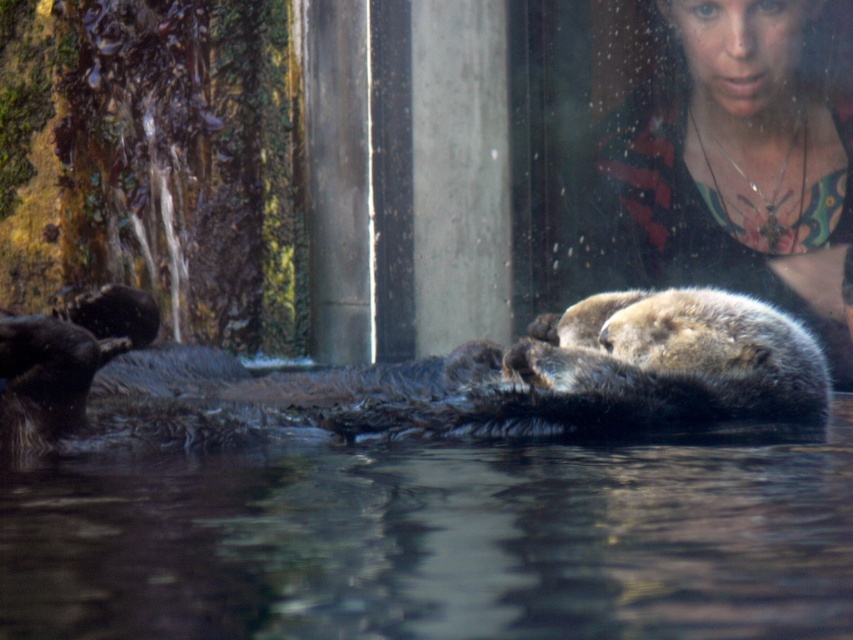
Consider the image. Does transparent water at center have a lesser width compared to smooth black shirt at upper right?

No, transparent water at center is not thinner than smooth black shirt at upper right.

In the scene shown: Who is shorter, transparent water at center or smooth black shirt at upper right?

transparent water at center

Which is in front, point (363, 538) or point (840, 248)?

Point (363, 538)

Find the location of a particular element. The image size is (853, 640). transparent water at center is located at coordinates (439, 541).

Who is positioned more to the left, dark brown fur otter at center or smooth black shirt at upper right?

Positioned to the left is dark brown fur otter at center.

Does point (471, 364) come in front of point (683, 124)?

Yes, point (471, 364) is closer to viewer.

Is point (148, 380) farther from camera compared to point (833, 305)?

No, (148, 380) is in front of (833, 305).

Find the location of `dark brown fur otter at center`. dark brown fur otter at center is located at coordinates (422, 381).

Is dark brown fur otter at center taller than brown fur otter at center?

Yes.

Between point (457, 435) and point (756, 326), which one is positioned in front?

Point (457, 435) is in front.

I want to click on dark brown fur otter at center, so click(422, 381).